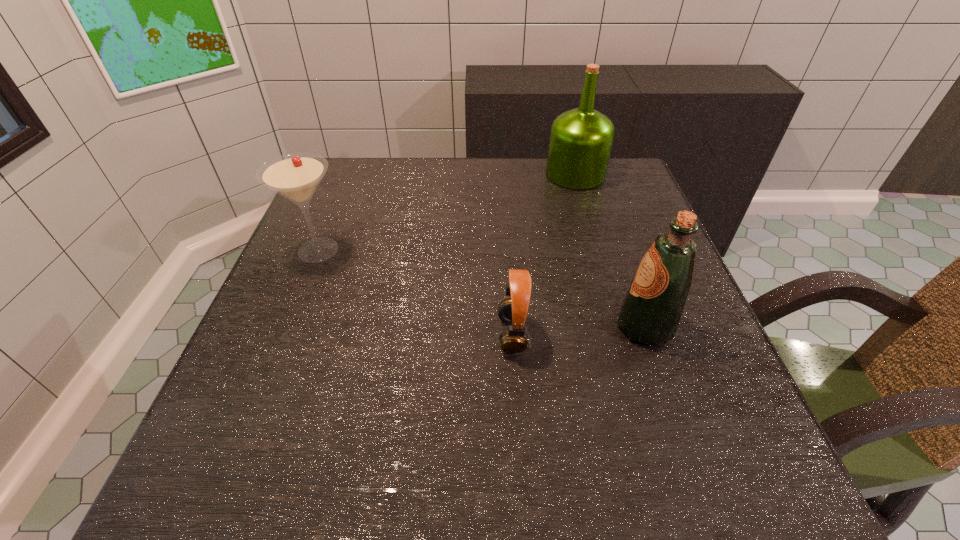
In the image, there is a desktop. Where is `free space at the right edge`? free space at the right edge is located at coordinates (633, 354).

The height and width of the screenshot is (540, 960). What are the coordinates of `vacant space at the far left corner of the desktop` in the screenshot? It's located at (363, 185).

Identify the location of vacant space at the far right corner of the desktop. (624, 191).

Image resolution: width=960 pixels, height=540 pixels. I want to click on vacant space at the near right corner of the desktop, so click(748, 490).

In order to click on free space between the third object from right to left and the farthest object in this screenshot , I will do `click(543, 254)`.

Where is `free space between the third tallest object and the farther olive oil`? The height and width of the screenshot is (540, 960). free space between the third tallest object and the farther olive oil is located at coordinates (447, 212).

The width and height of the screenshot is (960, 540). I want to click on empty space between the farther olive oil and the second object from left to right, so click(x=543, y=254).

Find the location of a particular element. The image size is (960, 540). free space between the nearer olive oil and the headset is located at coordinates (578, 330).

This screenshot has width=960, height=540. I want to click on vacant space that is in between the third tallest object and the farthest object, so click(447, 212).

Where is `free spot between the farther olive oil and the nearer olive oil`? This screenshot has width=960, height=540. free spot between the farther olive oil and the nearer olive oil is located at coordinates (610, 251).